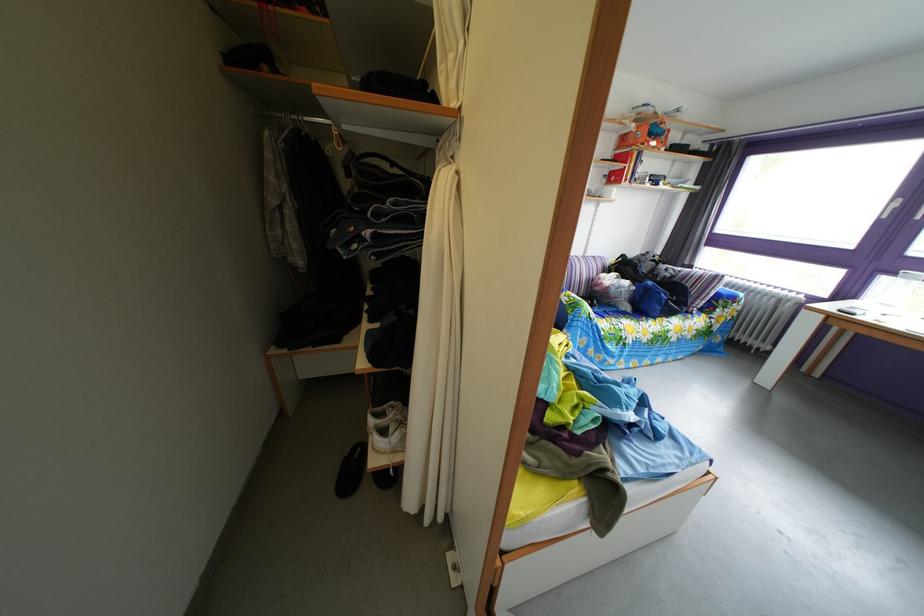
Find where to pull the grey window curtain. Please return your answer as a coordinate pair (x, y).

(439, 294)